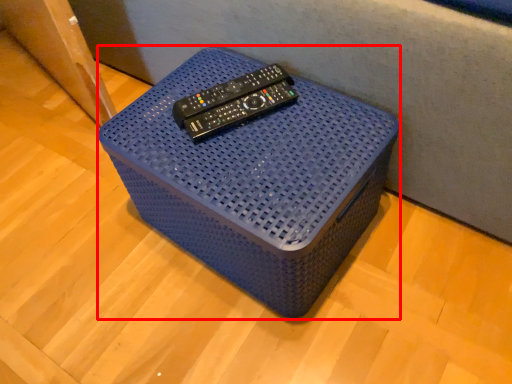
Question: From the image's perspective, where is furniture (annotated by the red box) located relative to remote?

Choices:
 (A) above
 (B) below

Answer: (B)